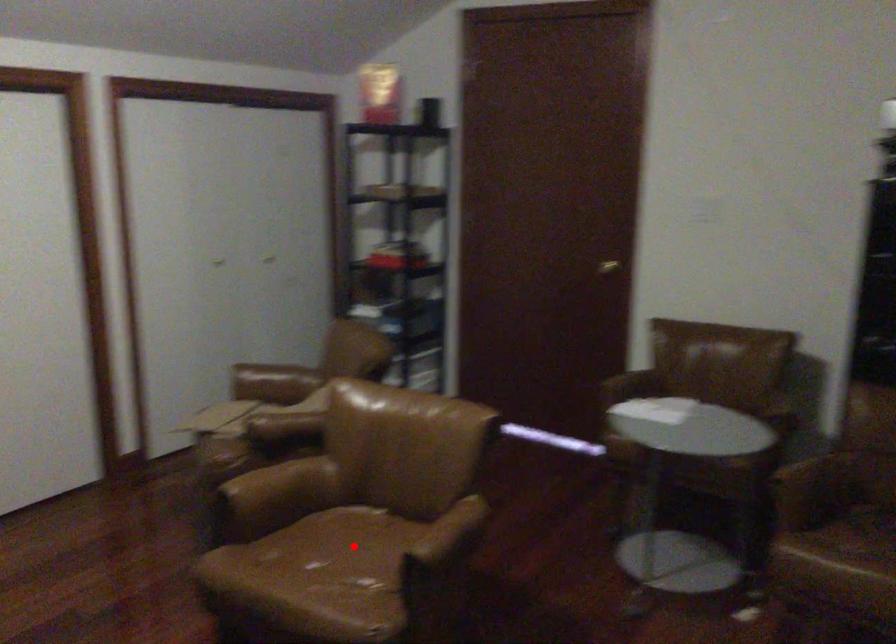
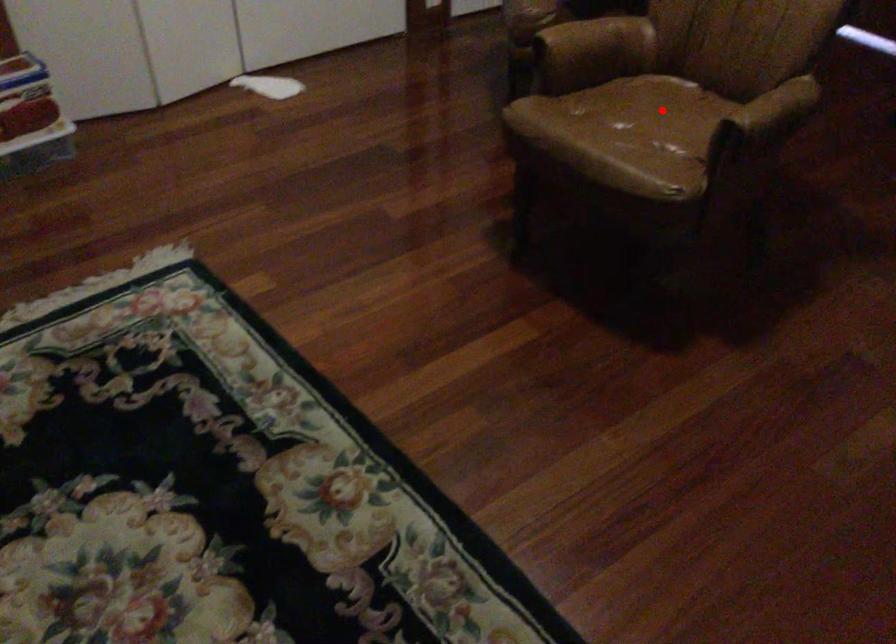
I am providing you with two images of the same scene from different viewpoints. A red point is marked on the first image and another point is marked on the second image. Is the marked point in image1 the same physical position as the marked point in image2?

Yes